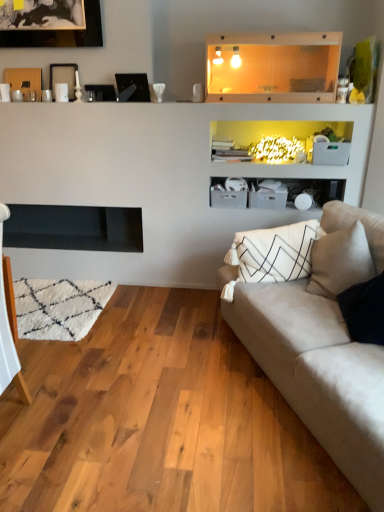
Question: Is wooden picture frame at upper left, the third picture frame from the right, positioned in front of black glass picture frame at upper center, marked as the 4th picture frame in a left-to-right arrangement?

Choices:
 (A) yes
 (B) no

Answer: (B)

Question: From a real-world perspective, is wooden picture frame at upper left, arranged as the second picture frame when viewed from the left, located higher than black glass picture frame at upper center, marked as the 4th picture frame in a left-to-right arrangement?

Choices:
 (A) yes
 (B) no

Answer: (A)

Question: Could you tell me if wooden picture frame at upper left, arranged as the second picture frame when viewed from the left, is turned towards black glass picture frame at upper center, the 1th picture frame when ordered from right to left?

Choices:
 (A) no
 (B) yes

Answer: (A)

Question: Considering the relative sizes of wooden picture frame at upper left, arranged as the second picture frame when viewed from the left, and black glass picture frame at upper center, marked as the 4th picture frame in a left-to-right arrangement, in the image provided, is wooden picture frame at upper left, arranged as the second picture frame when viewed from the left, smaller than black glass picture frame at upper center, marked as the 4th picture frame in a left-to-right arrangement,?

Choices:
 (A) no
 (B) yes

Answer: (B)

Question: Is wooden picture frame at upper left, the third picture frame from the right, positioned beyond the bounds of black glass picture frame at upper center, marked as the 4th picture frame in a left-to-right arrangement?

Choices:
 (A) yes
 (B) no

Answer: (A)

Question: From the image's perspective, relative to suede beige couch at right, is black matte picture frame at upper left, which is the 1th picture frame in left-to-right order, above or below?

Choices:
 (A) below
 (B) above

Answer: (B)

Question: From a real-world perspective, is black matte picture frame at upper left, which is the 1th picture frame in left-to-right order, physically located above or below suede beige couch at right?

Choices:
 (A) above
 (B) below

Answer: (A)

Question: Considering the positions of black matte picture frame at upper left, the 4th picture frame from the right, and suede beige couch at right in the image, is black matte picture frame at upper left, the 4th picture frame from the right, taller or shorter than suede beige couch at right?

Choices:
 (A) short
 (B) tall

Answer: (A)

Question: Is black matte picture frame at upper left, the 4th picture frame from the right, wider or thinner than suede beige couch at right?

Choices:
 (A) wide
 (B) thin

Answer: (B)

Question: From the image's perspective, is wooden picture frame at upper left, arranged as the second picture frame when viewed from the left, positioned above or below transparent glass shelf at upper center?

Choices:
 (A) below
 (B) above

Answer: (A)

Question: Is point (66, 71) closer or farther from the camera than point (294, 68)?

Choices:
 (A) closer
 (B) farther

Answer: (B)

Question: Is wooden picture frame at upper left, the third picture frame from the right, in front of or behind transparent glass shelf at upper center in the image?

Choices:
 (A) behind
 (B) front

Answer: (A)

Question: Is wooden picture frame at upper left, arranged as the second picture frame when viewed from the left, to the left or to the right of transparent glass shelf at upper center in the image?

Choices:
 (A) right
 (B) left

Answer: (B)

Question: In the image, is black glass picture frame at upper center, the 1th picture frame when ordered from right to left, on the left side or the right side of black matte fireplace at left?

Choices:
 (A) right
 (B) left

Answer: (A)

Question: Is black glass picture frame at upper center, the 1th picture frame when ordered from right to left, bigger or smaller than black matte fireplace at left?

Choices:
 (A) small
 (B) big

Answer: (A)